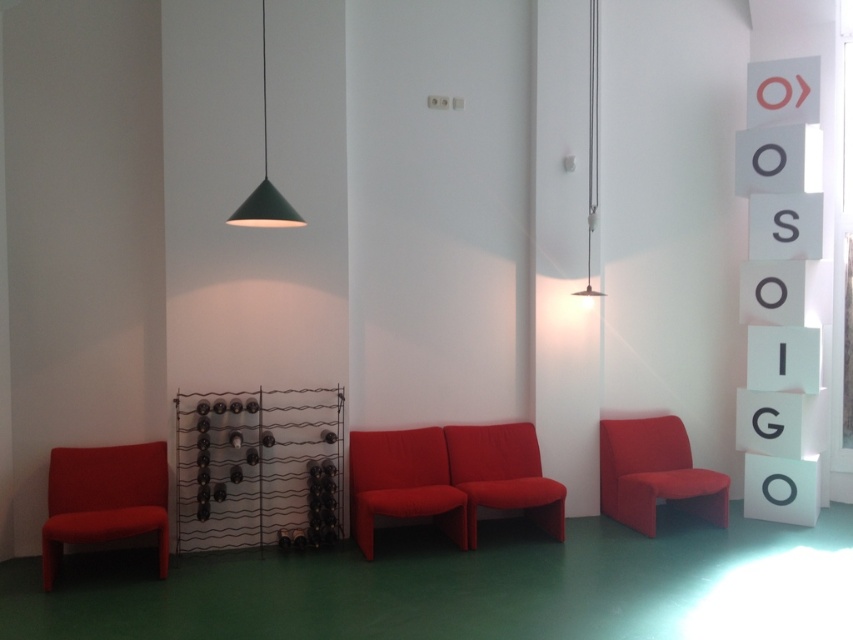
Question: Is matte red armchair at right thinner than matte red sofa at center?

Choices:
 (A) no
 (B) yes

Answer: (A)

Question: Is matte red armchair at right wider than matte red sofa at center?

Choices:
 (A) no
 (B) yes

Answer: (B)

Question: Is the position of matte red sofa at center more distant than that of green matte pendant light at upper center?

Choices:
 (A) yes
 (B) no

Answer: (A)

Question: Which of the following is the closest to the observer?

Choices:
 (A) (724, 486)
 (B) (595, 179)
 (C) (280, 209)

Answer: (C)

Question: Which is farther from the matte red sofa at center?

Choices:
 (A) matte red armchair at left
 (B) metallic pendant light at upper center
 (C) green matte pendant light at upper center

Answer: (B)

Question: Which of the following is the farthest from the observer?

Choices:
 (A) green matte pendant light at upper center
 (B) matte red armchair at left

Answer: (B)